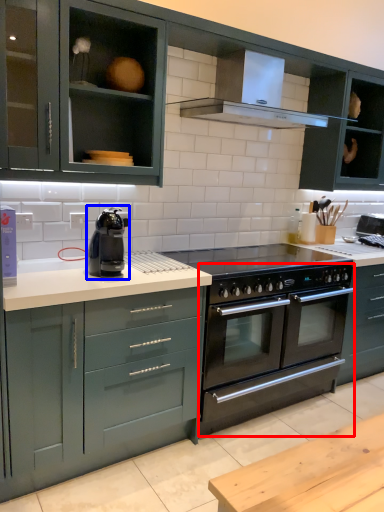
Question: Among these objects, which one is farthest to the camera, oven (highlighted by a red box) or home appliance (highlighted by a blue box)?

Choices:
 (A) oven
 (B) home appliance

Answer: (A)